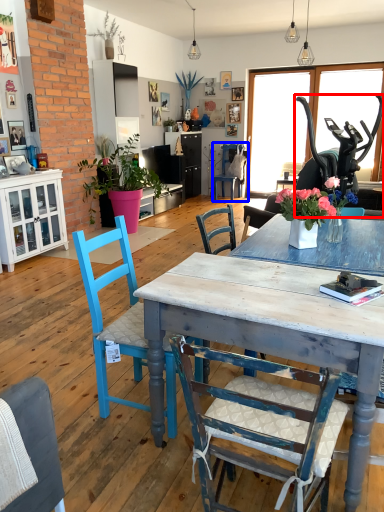
Question: Among these objects, which one is nearest to the camera, armchair (highlighted by a red box) or chair (highlighted by a blue box)?

Choices:
 (A) armchair
 (B) chair

Answer: (A)